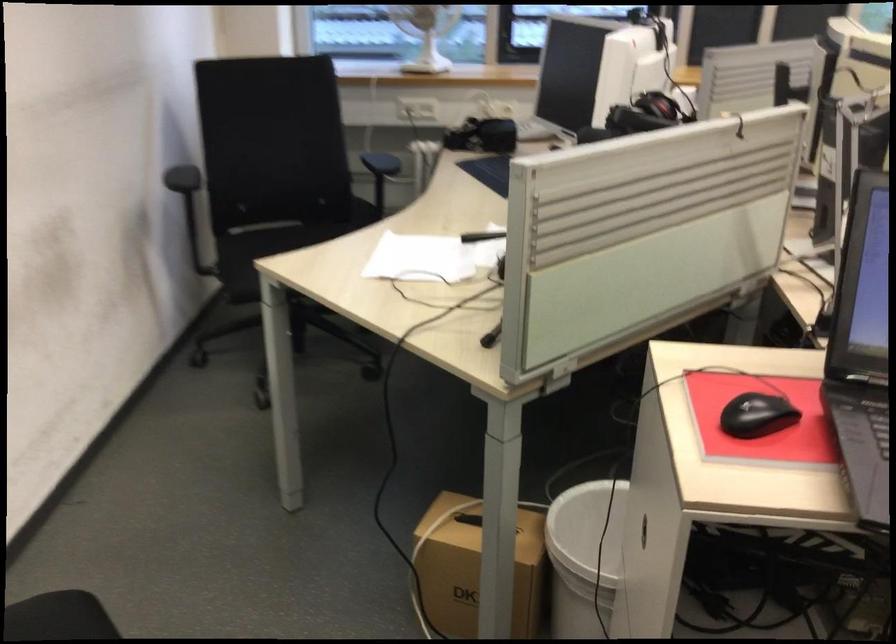
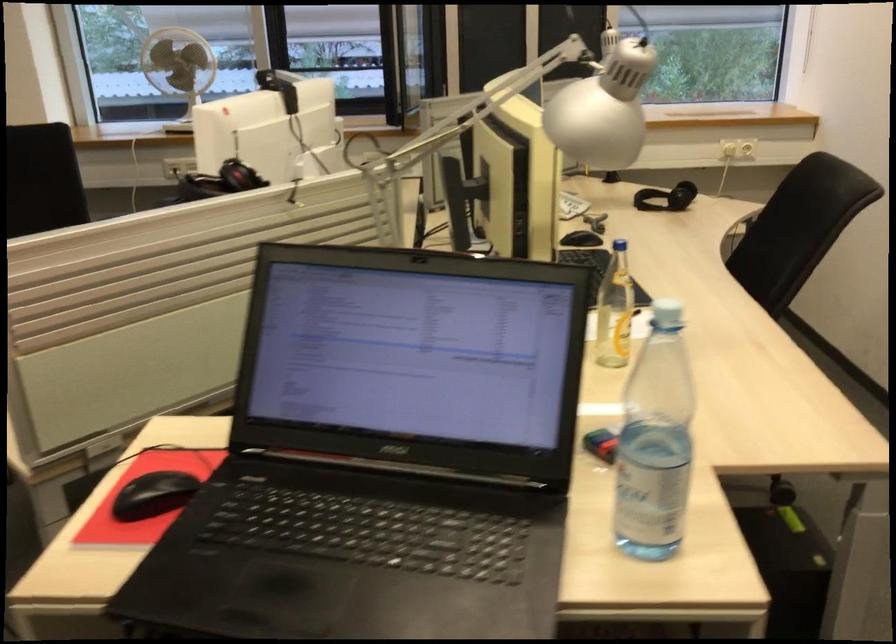
Find the pixel in the second image that matches the point at 638,109 in the first image.

(220, 182)